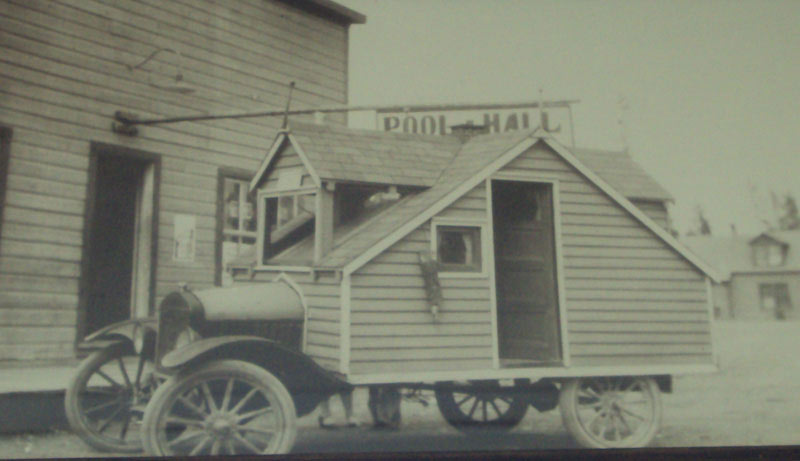
The height and width of the screenshot is (461, 800). In order to click on door in this screenshot , I will do `click(101, 224)`.